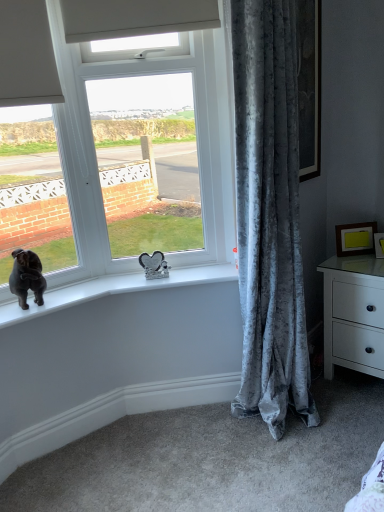
Where is `vacant space to the left of matte gold picture frame at right, which is the second picture frame in left-to-right order`? This screenshot has width=384, height=512. vacant space to the left of matte gold picture frame at right, which is the second picture frame in left-to-right order is located at coordinates (364, 261).